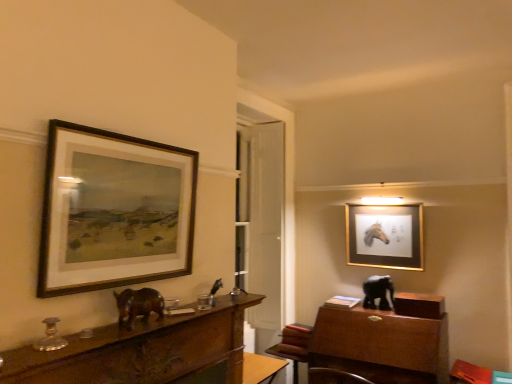
Question: From a real-world perspective, is shiny brown elephant at center, acting as the 2th animal starting from the back, located higher than gold metallic picture frame at upper right, which appears as the second picture frame when viewed from the front?

Choices:
 (A) yes
 (B) no

Answer: (B)

Question: Is shiny brown elephant at center, which is counted as the first animal, starting from the left, smaller than gold metallic picture frame at upper right, which appears as the 1th picture frame when viewed from the back?

Choices:
 (A) no
 (B) yes

Answer: (B)

Question: From the image's perspective, is shiny brown elephant at center, which is counted as the first animal, starting from the left, above gold metallic picture frame at upper right, which appears as the second picture frame when viewed from the front?

Choices:
 (A) no
 (B) yes

Answer: (A)

Question: Can gold metallic picture frame at upper right, which appears as the 1th picture frame when viewed from the back, be found inside shiny brown elephant at center, the first animal from the top?

Choices:
 (A) yes
 (B) no

Answer: (B)

Question: Considering the relative positions of shiny brown elephant at center, the first animal from the top, and gold metallic picture frame at upper right, marked as the second picture frame in a left-to-right arrangement, in the image provided, is shiny brown elephant at center, the first animal from the top, in front of gold metallic picture frame at upper right, marked as the second picture frame in a left-to-right arrangement,?

Choices:
 (A) yes
 (B) no

Answer: (A)

Question: Does shiny brown elephant at center, the first animal from the top, have a greater width compared to gold metallic picture frame at upper right, which appears as the second picture frame when viewed from the front?

Choices:
 (A) yes
 (B) no

Answer: (A)

Question: Is wooden-framed painting at upper left, the 2th picture frame positioned from the back, inside black glossy elephant at right, marked as the 2th animal in a top-to-bottom arrangement?

Choices:
 (A) no
 (B) yes

Answer: (A)

Question: Is black glossy elephant at right, placed as the first animal when sorted from bottom to top, at the left side of wooden-framed painting at upper left, the 2th picture frame positioned from the back?

Choices:
 (A) no
 (B) yes

Answer: (A)

Question: From the image's perspective, is black glossy elephant at right, which is the 1th animal in back-to-front order, located beneath wooden-framed painting at upper left, which appears as the first picture frame when viewed from the left?

Choices:
 (A) yes
 (B) no

Answer: (A)

Question: From a real-world perspective, is black glossy elephant at right, the 2th animal when ordered from front to back, located beneath wooden-framed painting at upper left, the 1th picture frame positioned from the front?

Choices:
 (A) no
 (B) yes

Answer: (B)

Question: Is black glossy elephant at right, which is the 1th animal in back-to-front order, facing away from wooden-framed painting at upper left, the second picture frame positioned from the right?

Choices:
 (A) yes
 (B) no

Answer: (B)

Question: Can you confirm if black glossy elephant at right, placed as the first animal when sorted from right to left, is bigger than wooden-framed painting at upper left, which appears as the first picture frame when viewed from the left?

Choices:
 (A) no
 (B) yes

Answer: (A)

Question: Is shiny brown elephant at center, which is the second animal from right to left, closer to camera compared to wooden table at center?

Choices:
 (A) yes
 (B) no

Answer: (A)